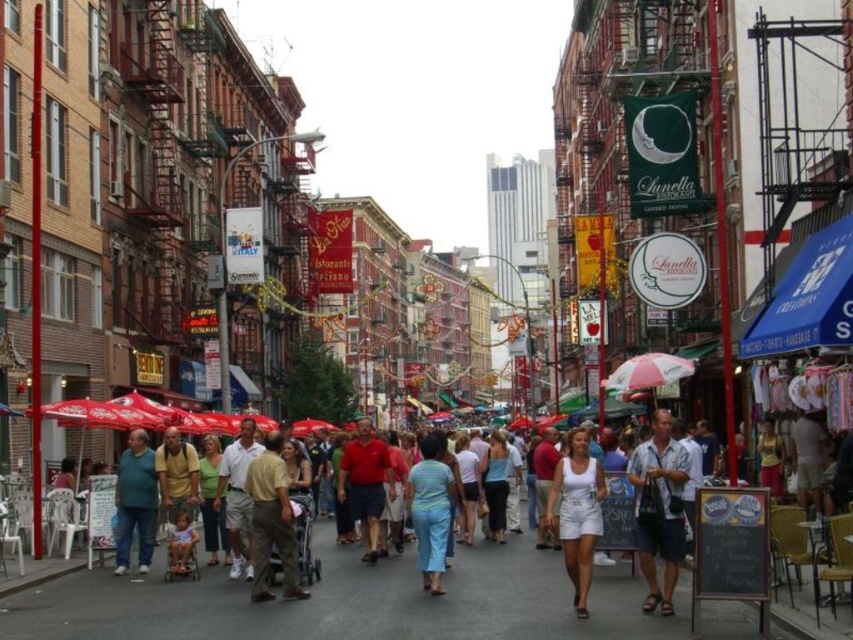
You are standing on the lively street and see both the white cotton shorts at center and the khaki cotton pants at center. Which one is nearer to you?

The white cotton shorts at center is closer to the viewer than the khaki cotton pants at center.

You are a delivery person trying to navigate through the busy street while carrying a package. You need to pass between the metallic stroller at center and the light blue fabric stroller at lower left. Which stroller should you avoid to ensure there is enough space for your delivery cart?

You should avoid the metallic stroller at center because its width is larger than the light blue fabric stroller at lower left, meaning there is less space between them. Choose the path next to the narrower light blue fabric stroller at lower left for better maneuverability.

You are a parent pushing a light blue fabric stroller at lower left and need to walk under a matte pink umbrella at center. Can you pass under it without bending down?

The matte pink umbrella at center is much taller than the light blue fabric stroller at lower left, so you can pass under it without bending down.